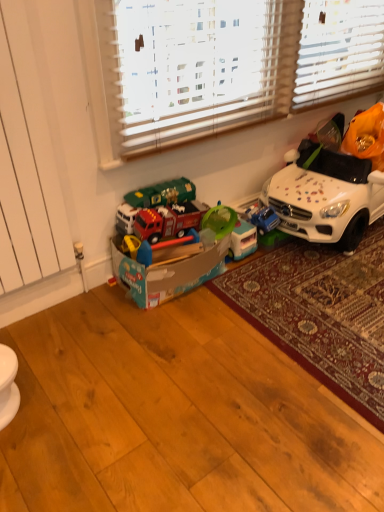
Question: Can you confirm if white matte toy car at right is shorter than carpeted rug at lower right?

Choices:
 (A) yes
 (B) no

Answer: (B)

Question: Is white matte toy car at right thinner than carpeted rug at lower right?

Choices:
 (A) no
 (B) yes

Answer: (B)

Question: Can you confirm if white matte toy car at right is positioned to the left of carpeted rug at lower right?

Choices:
 (A) no
 (B) yes

Answer: (B)

Question: Considering the relative sizes of white matte toy car at right and carpeted rug at lower right in the image provided, is white matte toy car at right bigger than carpeted rug at lower right?

Choices:
 (A) yes
 (B) no

Answer: (A)

Question: From a real-world perspective, is white matte toy car at right physically above carpeted rug at lower right?

Choices:
 (A) no
 (B) yes

Answer: (B)

Question: Can you confirm if white matte toy car at right is taller than carpeted rug at lower right?

Choices:
 (A) no
 (B) yes

Answer: (B)

Question: Is green plastic cup at center, the second toy from the right, not close to carpeted rug at lower right?

Choices:
 (A) no
 (B) yes

Answer: (A)

Question: Is green plastic cup at center, arranged as the 2th toy when viewed from the left, oriented away from carpeted rug at lower right?

Choices:
 (A) yes
 (B) no

Answer: (B)

Question: From the image's perspective, does green plastic cup at center, the second toy from the right, appear lower than carpeted rug at lower right?

Choices:
 (A) yes
 (B) no

Answer: (B)

Question: Is green plastic cup at center, arranged as the 2th toy when viewed from the left, facing towards carpeted rug at lower right?

Choices:
 (A) yes
 (B) no

Answer: (B)

Question: Can you confirm if green plastic cup at center, the second toy from the right, is positioned to the right of carpeted rug at lower right?

Choices:
 (A) no
 (B) yes

Answer: (A)

Question: From a real-world perspective, does green plastic cup at center, the second toy from the right, sit lower than carpeted rug at lower right?

Choices:
 (A) no
 (B) yes

Answer: (A)

Question: Considering the relative sizes of blue plastic toy car at center, arranged as the third toy when viewed from the left, and white textured blinds at upper center in the image provided, is blue plastic toy car at center, arranged as the third toy when viewed from the left, smaller than white textured blinds at upper center?

Choices:
 (A) yes
 (B) no

Answer: (A)